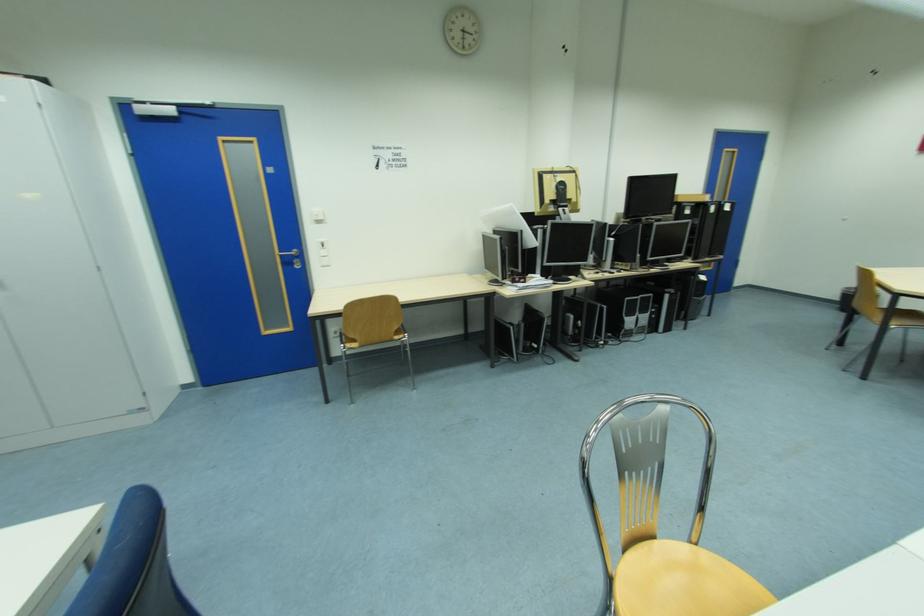
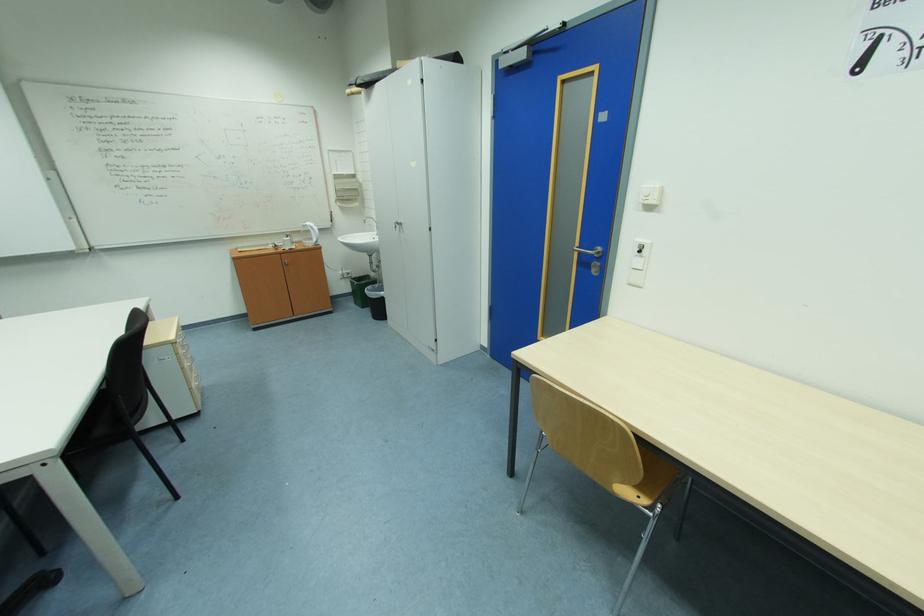
The point at (295, 264) is marked in the first image. Where is the corresponding point in the second image?

(590, 264)